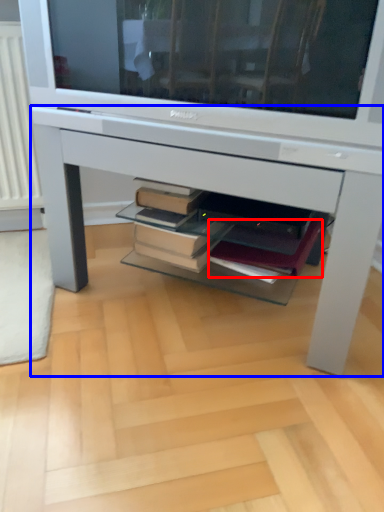
Question: Which of the following is the closest to the observer, paperback book (highlighted by a red box) or desk (highlighted by a blue box)?

Choices:
 (A) paperback book
 (B) desk

Answer: (B)